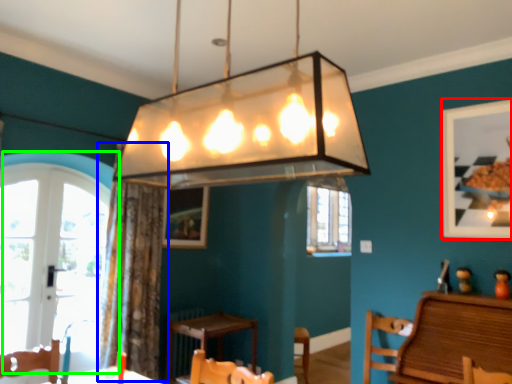
Question: Estimate the real-world distances between objects in this image. Which object is closer to picture frame (highlighted by a red box), curtain (highlighted by a blue box) or window (highlighted by a green box)?

Choices:
 (A) curtain
 (B) window

Answer: (A)